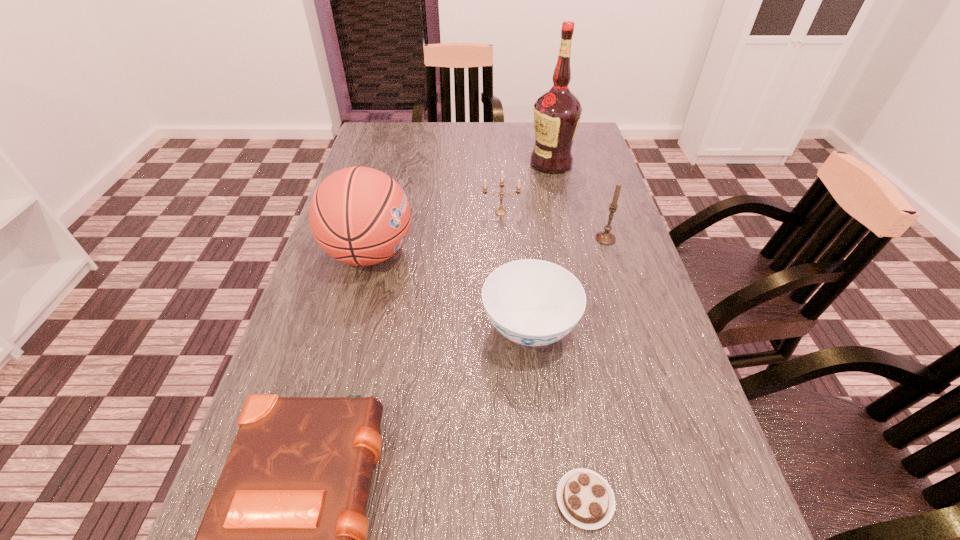
I want to click on free location located on the label of the alcohol, so click(420, 164).

You are a GUI agent. You are given a task and a screenshot of the screen. Output one action in this format:
    pyautogui.click(x=<x>, y=<y>)
    Task: Click on the vacant space located 0.160m on the label of the alcohol
    
    Given the screenshot: What is the action you would take?
    pyautogui.click(x=478, y=164)

Locate an element on the screen. This screenshot has height=540, width=960. vacant area located 0.070m on the label of the alcohol is located at coordinates (507, 164).

I want to click on vacant space located 0.060m on the logo side of the second tallest object, so click(440, 253).

Where is `free space located 0.250m on the back of the third tallest object`? This screenshot has height=540, width=960. free space located 0.250m on the back of the third tallest object is located at coordinates (587, 179).

Locate an element on the screen. The image size is (960, 540). free spot located on the left of the fourth tallest object is located at coordinates (381, 213).

Identify the location of vacant region located 0.250m on the front of the third nearest object. pos(548,510).

Identify the location of free location located on the back of the chocolate cake. (572, 418).

Locate an element on the screen. This screenshot has width=960, height=540. object at the far edge is located at coordinates (557, 112).

Where is `object that is at the left edge`? The height and width of the screenshot is (540, 960). object that is at the left edge is located at coordinates (360, 216).